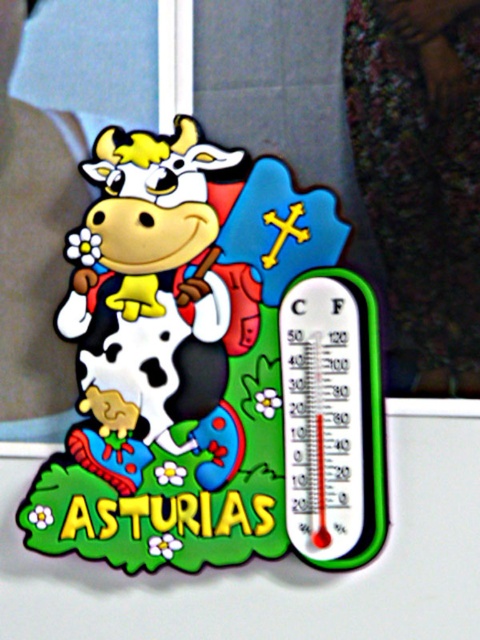
Question: Among these points, which one is nearest to the camera?

Choices:
 (A) (326, 353)
 (B) (202, 196)

Answer: (A)

Question: Where is matte plastic cow at center located in relation to transparent plastic thermometer at right in the image?

Choices:
 (A) above
 (B) below

Answer: (A)

Question: From the image, what is the correct spatial relationship of matte plastic cow at center in relation to transparent plastic thermometer at right?

Choices:
 (A) above
 (B) below

Answer: (A)

Question: Which object appears farthest from the camera in this image?

Choices:
 (A) transparent plastic thermometer at right
 (B) matte plastic cow at center

Answer: (A)

Question: Is matte plastic cow at center closer to the viewer compared to transparent plastic thermometer at right?

Choices:
 (A) yes
 (B) no

Answer: (A)